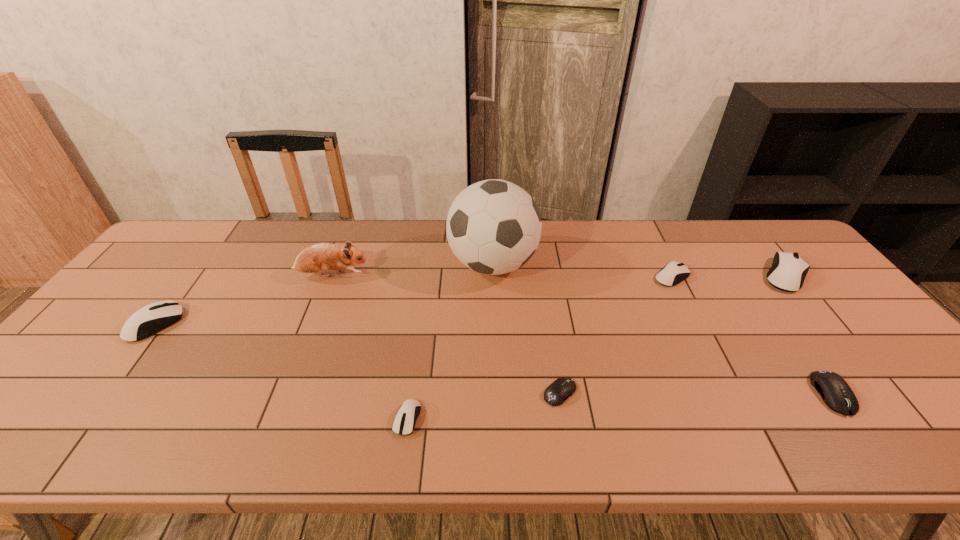
Image resolution: width=960 pixels, height=540 pixels. I want to click on vacant space located on the front of the third object from right to left, so click(702, 337).

You are a GUI agent. You are given a task and a screenshot of the screen. Output one action in this format:
    pyautogui.click(x=<x>, y=<y>)
    Task: Click on the free space located 0.110m on the left of the bigger black computer equipment
    Image resolution: width=960 pixels, height=540 pixels.
    Given the screenshot: What is the action you would take?
    pyautogui.click(x=769, y=394)

This screenshot has height=540, width=960. Identify the location of free space located 0.120m on the left of the third white mouse from right to left. (x=340, y=419).

The width and height of the screenshot is (960, 540). Find the location of `free space located 0.100m on the front of the fourth computer equipment from right to left`. free space located 0.100m on the front of the fourth computer equipment from right to left is located at coordinates (569, 449).

Find the location of `soccer ball that is at the far edge`. soccer ball that is at the far edge is located at coordinates (493, 227).

This screenshot has height=540, width=960. I want to click on mouse located in the far edge section of the desktop, so click(788, 271).

I want to click on object situated at the left edge, so click(x=149, y=320).

The image size is (960, 540). I want to click on object that is at the right edge, so click(788, 271).

The width and height of the screenshot is (960, 540). Find the location of `object that is at the far right corner`. object that is at the far right corner is located at coordinates (788, 271).

This screenshot has width=960, height=540. I want to click on vacant region at the far edge, so click(292, 262).